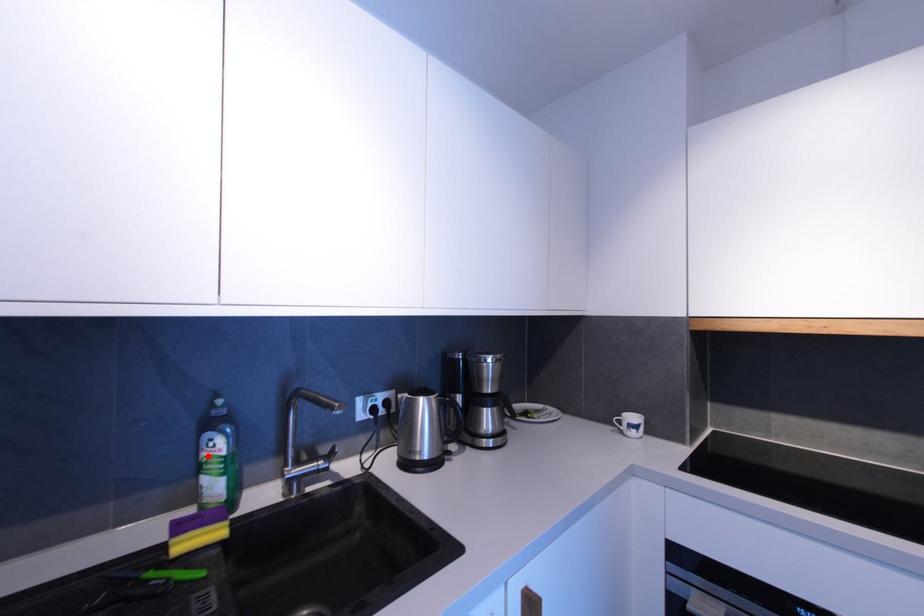
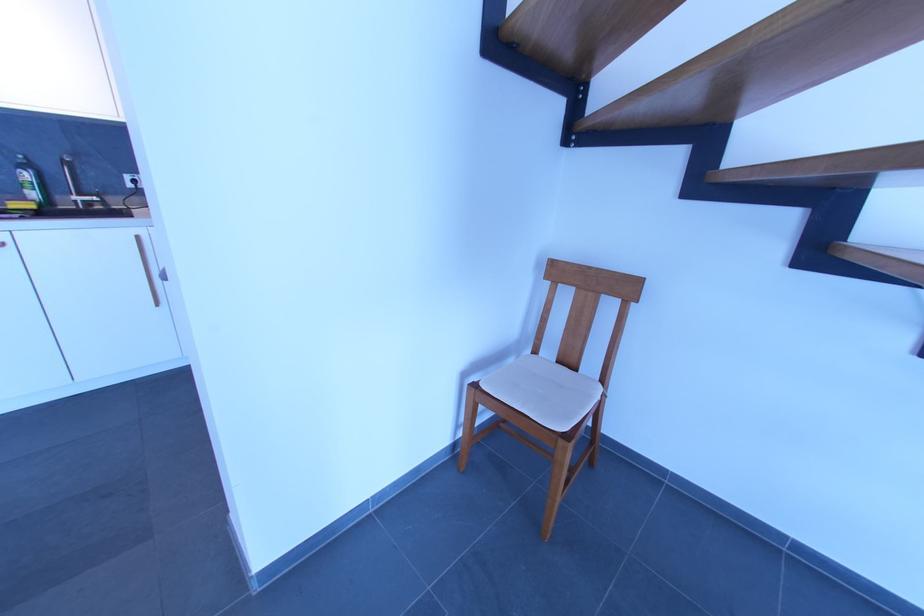
Question: I am providing you with two images of the same scene from different viewpoints. A red point is marked on the first image. Is the red point's position out of view in image 2?

Choices:
 (A) Yes
 (B) No

Answer: (B)